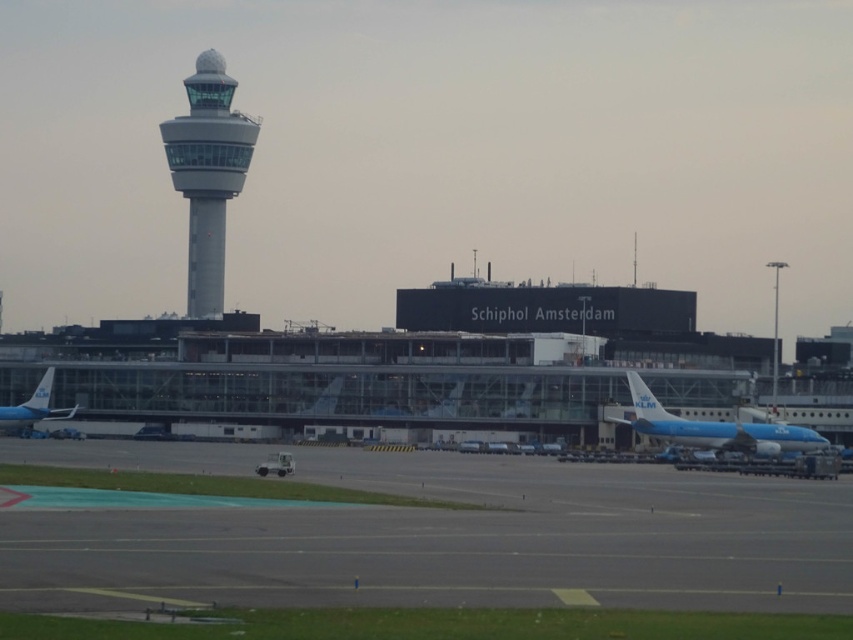
Question: Is glassy gray control tower at upper left closer to camera compared to blue painted airplane at lower left?

Choices:
 (A) yes
 (B) no

Answer: (B)

Question: Which point is farther to the camera?

Choices:
 (A) pyautogui.click(x=177, y=168)
 (B) pyautogui.click(x=775, y=451)
 (C) pyautogui.click(x=32, y=580)

Answer: (A)

Question: Is the position of glassy gray control tower at upper left more distant than that of blue painted airplane at lower left?

Choices:
 (A) no
 (B) yes

Answer: (B)

Question: Which point appears closest to the camera in this image?

Choices:
 (A) (643, 381)
 (B) (218, 176)
 (C) (68, 412)
 (D) (683, 586)

Answer: (D)

Question: Which point appears farthest from the camera in this image?

Choices:
 (A) (821, 435)
 (B) (590, 586)

Answer: (A)

Question: Does glassy gray control tower at upper left appear over blue metallic airplane at lower right?

Choices:
 (A) yes
 (B) no

Answer: (A)